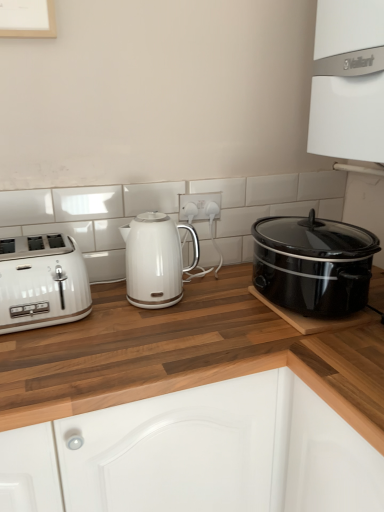
Find the location of a particular element. Image resolution: width=384 pixels, height=512 pixels. space that is in front of white glossy kettle at center is located at coordinates (165, 327).